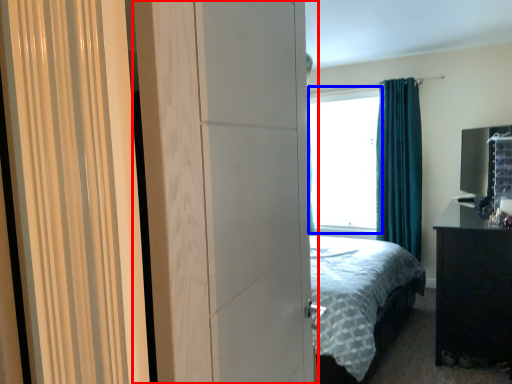
Question: Which point is further to the camera, screen door (highlighted by a red box) or window screen (highlighted by a blue box)?

Choices:
 (A) screen door
 (B) window screen

Answer: (B)